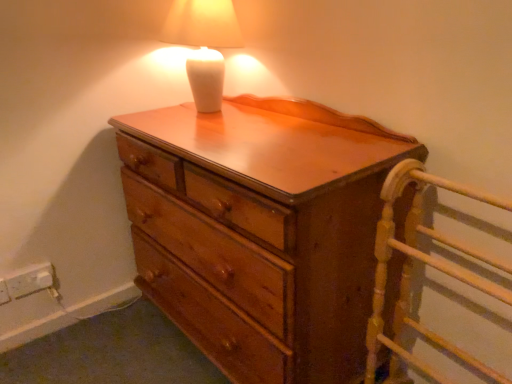
This screenshot has width=512, height=384. I want to click on white glossy lamp at upper center, so click(x=204, y=45).

Where is `white plastic electric outlet at lower left`? This screenshot has height=384, width=512. white plastic electric outlet at lower left is located at coordinates (28, 281).

How much distance is there between wooden bed frame at right and white plastic electric outlet at lower left?

They are 4.05 feet apart.

Considering the sizes of objects wooden bed frame at right and white plastic electric outlet at lower left in the image provided, who is bigger, wooden bed frame at right or white plastic electric outlet at lower left?

wooden bed frame at right.

Is wooden bed frame at right further to camera compared to white plastic electric outlet at lower left?

No, wooden bed frame at right is in front of white plastic electric outlet at lower left.

Between wooden bed frame at right and white plastic electric outlet at lower left, which one has smaller width?

white plastic electric outlet at lower left is thinner.

Is point (490, 292) positioned behind point (217, 27)?

No.

Does wooden bed frame at right touch white glossy lamp at upper center?

They are not placed beside each other.

Can white glossy lamp at upper center be found inside wooden bed frame at right?

No, white glossy lamp at upper center is not surrounded by wooden bed frame at right.

Who is shorter, wooden bed frame at right or white glossy lamp at upper center?

Standing shorter between the two is white glossy lamp at upper center.

Does wooden chest of drawers at center contain white glossy lamp at upper center?

No, white glossy lamp at upper center is not surrounded by wooden chest of drawers at center.

From a real-world perspective, who is located lower, wooden chest of drawers at center or white glossy lamp at upper center?

wooden chest of drawers at center.

Measure the distance between wooden chest of drawers at center and white glossy lamp at upper center.

wooden chest of drawers at center is 48.81 centimeters away from white glossy lamp at upper center.

Would you say wooden chest of drawers at center is a long distance from white glossy lamp at upper center?

That's not correct — wooden chest of drawers at center is a little close to white glossy lamp at upper center.

From the picture: From a real-world perspective, does white plastic electric outlet at lower left stand above white glossy lamp at upper center?

No, from a real-world perspective, white plastic electric outlet at lower left is not above white glossy lamp at upper center.

Considering the positions of objects white plastic electric outlet at lower left and white glossy lamp at upper center in the image provided, who is in front, white plastic electric outlet at lower left or white glossy lamp at upper center?

white glossy lamp at upper center is closer to the camera.

From the image's perspective, which is below, white plastic electric outlet at lower left or white glossy lamp at upper center?

white plastic electric outlet at lower left.

Is white plastic electric outlet at lower left touching white glossy lamp at upper center?

No, white plastic electric outlet at lower left is not making contact with white glossy lamp at upper center.

Can you confirm if white glossy lamp at upper center is wider than wooden bed frame at right?

No.

Can you confirm if white glossy lamp at upper center is smaller than wooden bed frame at right?

Yes, white glossy lamp at upper center is smaller than wooden bed frame at right.

Considering the relative sizes of white glossy lamp at upper center and wooden bed frame at right in the image provided, is white glossy lamp at upper center shorter than wooden bed frame at right?

Correct, white glossy lamp at upper center is not as tall as wooden bed frame at right.

Which is correct: white glossy lamp at upper center is inside wooden bed frame at right, or outside of it?

white glossy lamp at upper center is spatially situated outside wooden bed frame at right.

Does wooden bed frame at right touch wooden chest of drawers at center?

No, wooden bed frame at right is not in contact with wooden chest of drawers at center.

Is wooden bed frame at right inside or outside of wooden chest of drawers at center?

wooden bed frame at right lies outside wooden chest of drawers at center.

Between wooden bed frame at right and wooden chest of drawers at center, which one has more height?

wooden chest of drawers at center.

Considering the relative sizes of wooden bed frame at right and wooden chest of drawers at center in the image provided, is wooden bed frame at right smaller than wooden chest of drawers at center?

Indeed, wooden bed frame at right has a smaller size compared to wooden chest of drawers at center.

How many degrees apart are the facing directions of wooden chest of drawers at center and wooden bed frame at right?

wooden chest of drawers at center and wooden bed frame at right are facing 5.45 degrees away from each other.

Is wooden chest of drawers at center situated inside wooden bed frame at right or outside?

wooden chest of drawers at center lies outside wooden bed frame at right.

The height and width of the screenshot is (384, 512). Identify the location of bed frame in front of the wooden chest of drawers at center. (411, 270).

Between wooden chest of drawers at center and wooden bed frame at right, which one has larger size?

wooden chest of drawers at center is bigger.

Where is `bed frame on the right of white plastic electric outlet at lower left`? This screenshot has height=384, width=512. bed frame on the right of white plastic electric outlet at lower left is located at coordinates (411, 270).

Where is `lamp on the left of wooden bed frame at right`? lamp on the left of wooden bed frame at right is located at coordinates (204, 45).

Which object lies further to the anchor point white glossy lamp at upper center, wooden chest of drawers at center or wooden bed frame at right?

wooden bed frame at right is further to white glossy lamp at upper center.

Which object lies nearer to the anchor point wooden bed frame at right, white plastic electric outlet at lower left or white glossy lamp at upper center?

The object closer to wooden bed frame at right is white glossy lamp at upper center.

When comparing their distances from white plastic electric outlet at lower left, does wooden bed frame at right or wooden chest of drawers at center seem closer?

wooden chest of drawers at center lies closer to white plastic electric outlet at lower left than the other object.

Considering their positions, is white plastic electric outlet at lower left positioned further to wooden chest of drawers at center than wooden bed frame at right?

Based on the image, white plastic electric outlet at lower left appears to be further to wooden chest of drawers at center.

Considering their positions, is white glossy lamp at upper center positioned closer to wooden bed frame at right than white plastic electric outlet at lower left?

white glossy lamp at upper center is positioned closer to the anchor wooden bed frame at right.

In the scene shown: Looking at the image, which one is located closer to wooden bed frame at right, wooden chest of drawers at center or white glossy lamp at upper center?

The object closer to wooden bed frame at right is wooden chest of drawers at center.

Based on their spatial positions, is wooden bed frame at right or white plastic electric outlet at lower left closer to white glossy lamp at upper center?

Among the two, wooden bed frame at right is located nearer to white glossy lamp at upper center.

Looking at the image, which one is located further to wooden chest of drawers at center, white glossy lamp at upper center or white plastic electric outlet at lower left?

white plastic electric outlet at lower left lies further to wooden chest of drawers at center than the other object.

Image resolution: width=512 pixels, height=384 pixels. I want to click on the chest of drawers that lies between white glossy lamp at upper center and wooden bed frame at right from top to bottom, so click(x=261, y=230).

Where is `the chest of drawers located between white plastic electric outlet at lower left and wooden bed frame at right in the left-right direction`? the chest of drawers located between white plastic electric outlet at lower left and wooden bed frame at right in the left-right direction is located at coordinates (261, 230).

I want to click on lamp between white plastic electric outlet at lower left and wooden bed frame at right, so click(204, 45).

Where is `chest of drawers between white glossy lamp at upper center and white plastic electric outlet at lower left in the vertical direction`? The width and height of the screenshot is (512, 384). chest of drawers between white glossy lamp at upper center and white plastic electric outlet at lower left in the vertical direction is located at coordinates 261,230.